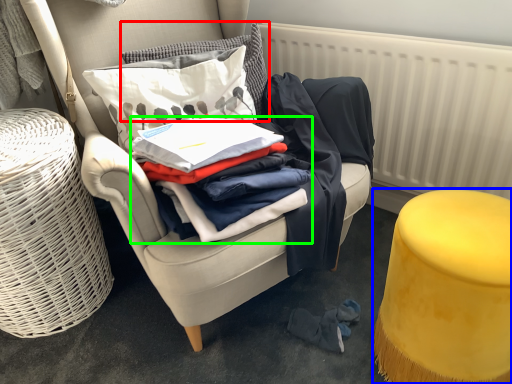
Question: Which object is the farthest from pillow (highlighted by a red box)? Choose among these: stool (highlighted by a blue box) or clothing (highlighted by a green box).

Choices:
 (A) stool
 (B) clothing

Answer: (A)